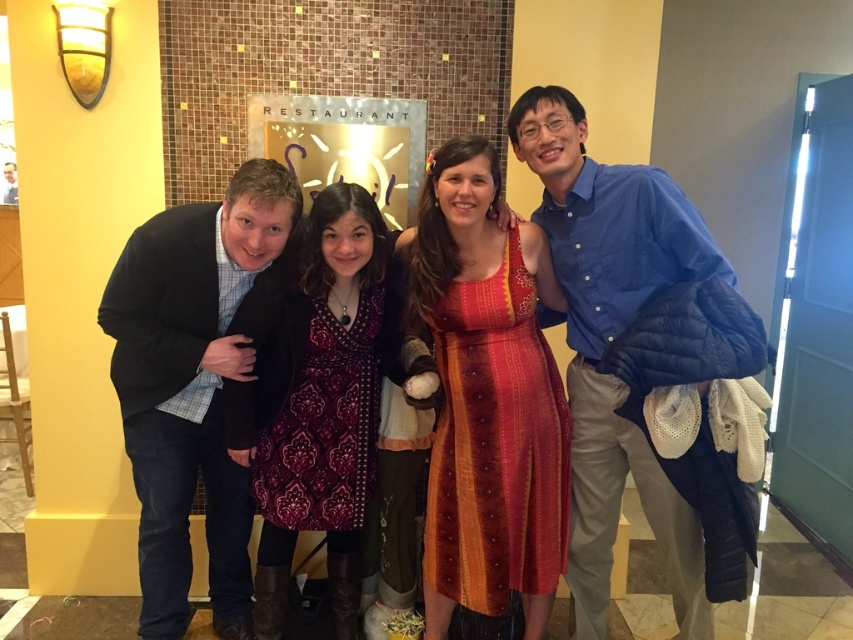
Question: Among these objects, which one is farthest from the camera?

Choices:
 (A) blue cotton shirt at right
 (B) textured orange dress at center
 (C) matte black jacket at left
 (D) patterned fabric dress at center

Answer: (D)

Question: Does textured orange dress at center appear on the left side of blue cotton shirt at left?

Choices:
 (A) yes
 (B) no

Answer: (B)

Question: Can you confirm if matte black jacket at left is wider than blue cotton shirt at left?

Choices:
 (A) no
 (B) yes

Answer: (B)

Question: Which point is closer to the camera taking this photo?

Choices:
 (A) (280, 604)
 (B) (508, 289)
 (C) (231, 560)
 (D) (589, 371)

Answer: (B)

Question: Does matte black jacket at left come in front of textured orange dress at center?

Choices:
 (A) yes
 (B) no

Answer: (A)

Question: Which of the following is the closest to the observer?

Choices:
 (A) blue cotton shirt at right
 (B) blue cotton shirt at left
 (C) textured orange dress at center
 (D) patterned fabric dress at center

Answer: (B)